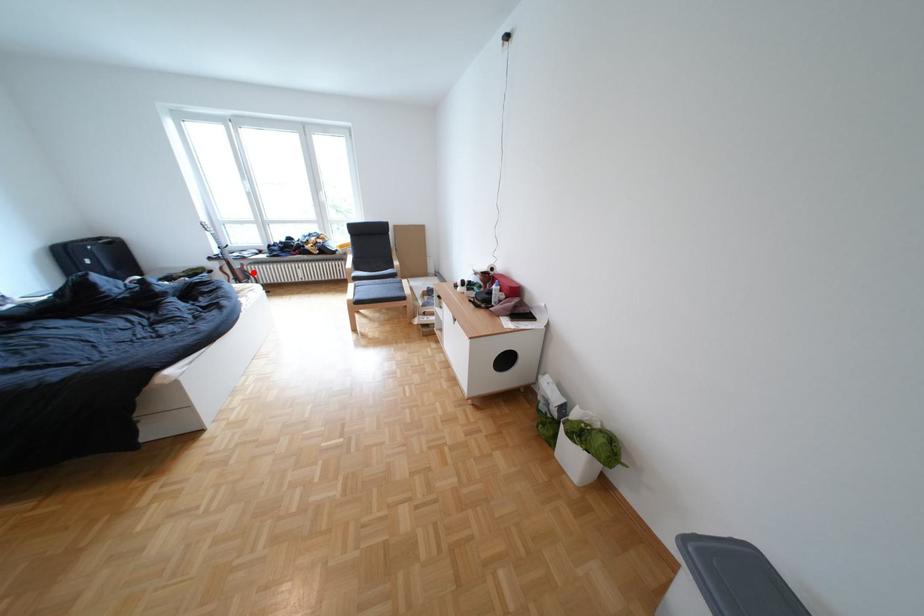
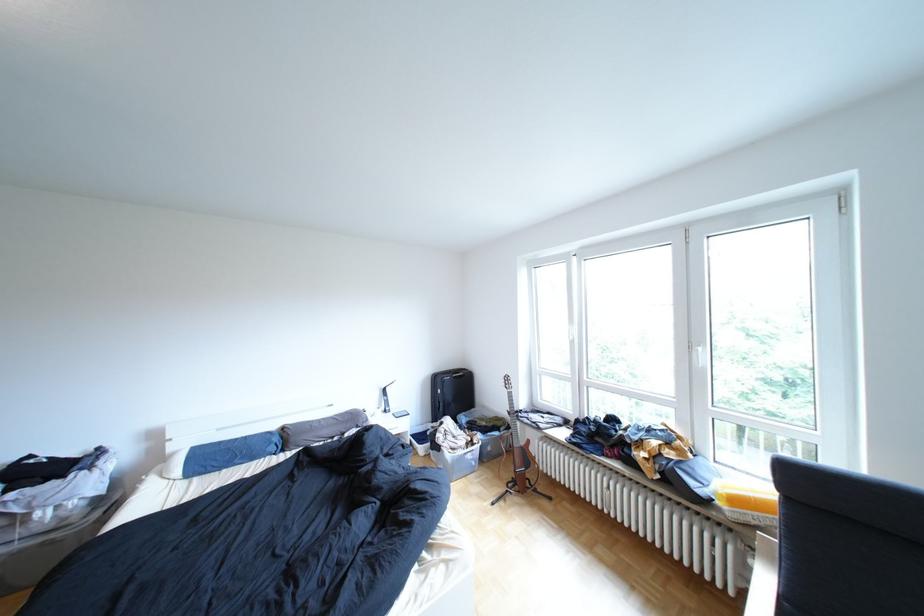
Find the pixel in the second image that matches the highlighted location in the first image.

(532, 453)